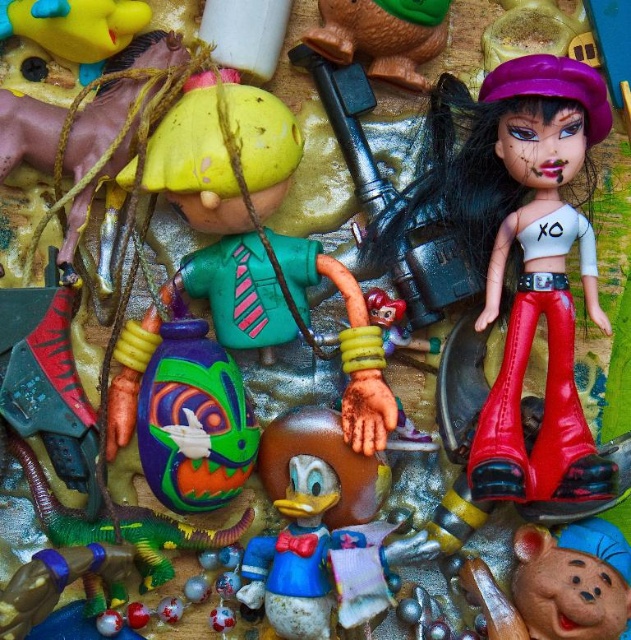
You are a child trying to place a new toy between the smooth brown bear at center and the rubber duck at upper center. The new toy is 12 inches long. Can it fit in the space between them?

The space between the smooth brown bear at center and the rubber duck at upper center is 19.36 inches. Since the new toy is 12 inches long, it can fit in the space between them because 12 inches is shorter than 19.36 inches.

You are organizing a toy shelf and need to place the shiny red leather pants at right and the rubber duck at upper center. According to the scene, which toy is located to the right of the other?

The shiny red leather pants at right is positioned on the right side of the rubber duck at upper center.

You are a child trying to reach the shiny red leather pants at right. You are currently standing at the viewer position. If your arm can extend 34 inches, can you grab it?

The shiny red leather pants at right and viewer are 34.96 inches apart from each other. Since your arm can only extend 34 inches, you cannot reach the shiny red leather pants at right.